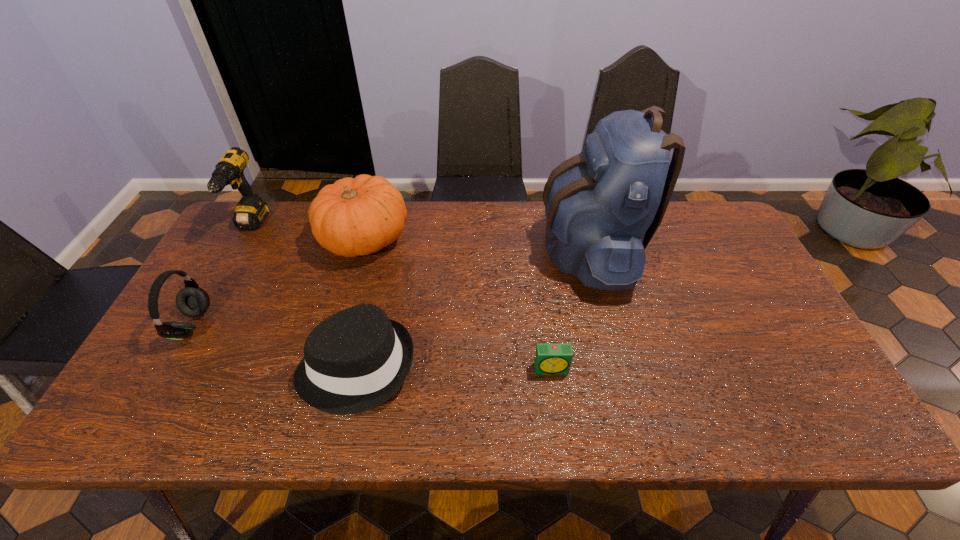
You are a GUI agent. You are given a task and a screenshot of the screen. Output one action in this format:
    pyautogui.click(x=<x>, y=<y>)
    Task: Click on the free space located 0.170m on the right of the pumpkin
    The image size is (960, 540).
    Given the screenshot: What is the action you would take?
    pyautogui.click(x=464, y=239)

This screenshot has width=960, height=540. What are the coordinates of `vacant space located on the ear cups of the headset` in the screenshot? It's located at (273, 325).

In order to click on vacant space located 0.280m on the right of the fedora in this screenshot , I will do `click(533, 367)`.

The width and height of the screenshot is (960, 540). Find the location of `vacant space located 0.080m on the front-facing side of the alarm clock`. vacant space located 0.080m on the front-facing side of the alarm clock is located at coordinates (557, 407).

Locate an element on the screen. This screenshot has width=960, height=540. backpack present at the far edge is located at coordinates (603, 206).

You are a GUI agent. You are given a task and a screenshot of the screen. Output one action in this format:
    pyautogui.click(x=<x>, y=<y>)
    Task: Click on the drill located in the far edge section of the desktop
    
    Given the screenshot: What is the action you would take?
    pyautogui.click(x=250, y=212)

In order to click on pumpkin present at the far edge in this screenshot , I will do `click(356, 216)`.

Where is `object that is at the near edge`? The height and width of the screenshot is (540, 960). object that is at the near edge is located at coordinates (355, 360).

Find the location of a particular element. The height and width of the screenshot is (540, 960). drill that is at the left edge is located at coordinates (250, 212).

Locate an element on the screen. This screenshot has width=960, height=540. headset that is at the left edge is located at coordinates (192, 301).